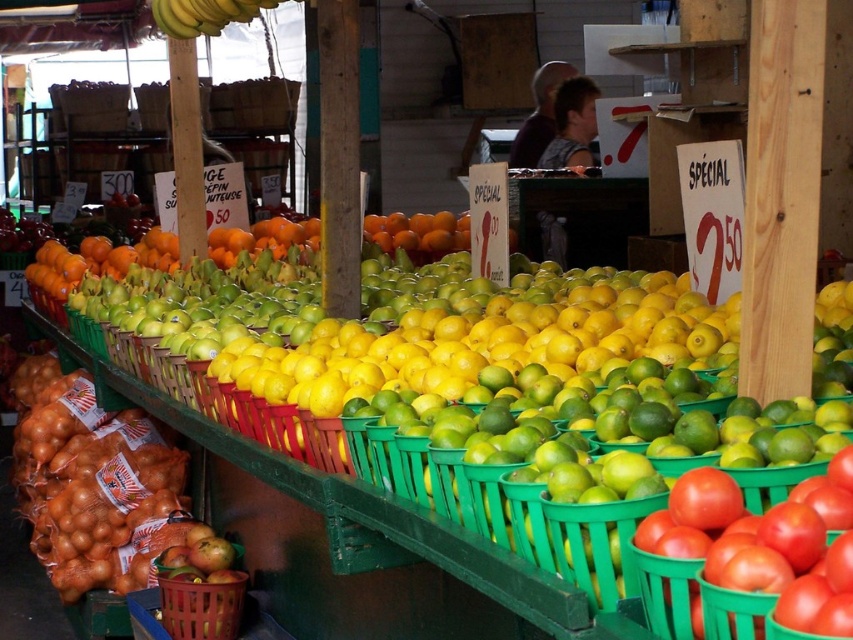
Which is below, brown papery onion at lower left or shiny red tomato at lower right?

brown papery onion at lower left is lower down.

At what (x,y) coordinates should I click in order to perform the action: click on brown papery onion at lower left. Please return your answer as a coordinate pair (x, y). Looking at the image, I should click on (91, 483).

Is brown papery onion at lower left shorter than matte brown basket at lower left?

No, brown papery onion at lower left is not shorter than matte brown basket at lower left.

Describe the element at coordinates (91, 483) in the screenshot. I see `brown papery onion at lower left` at that location.

Identify the location of brown papery onion at lower left. (91, 483).

Locate an element on the screen. The height and width of the screenshot is (640, 853). shiny red tomato at lower right is located at coordinates (759, 550).

From the picture: Is shiny red tomato at lower right positioned at the back of matte brown basket at lower left?

No.

Locate an element on the screen. The width and height of the screenshot is (853, 640). shiny red tomato at lower right is located at coordinates (759, 550).

At what (x,y) coordinates should I click in order to perform the action: click on shiny red tomato at lower right. Please return your answer as a coordinate pair (x, y). Looking at the image, I should click on [759, 550].